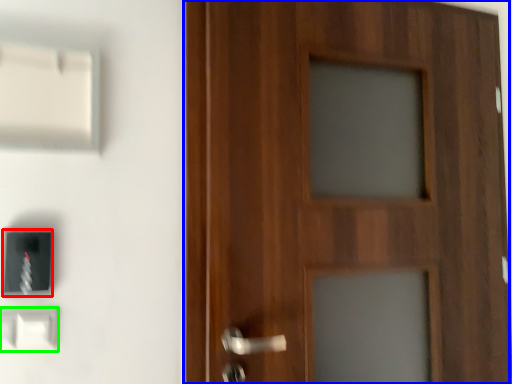
Question: Which object is the closest to the light switch (highlighted by a red box)? Choose among these: door (highlighted by a blue box) or light switch (highlighted by a green box).

Choices:
 (A) door
 (B) light switch

Answer: (B)